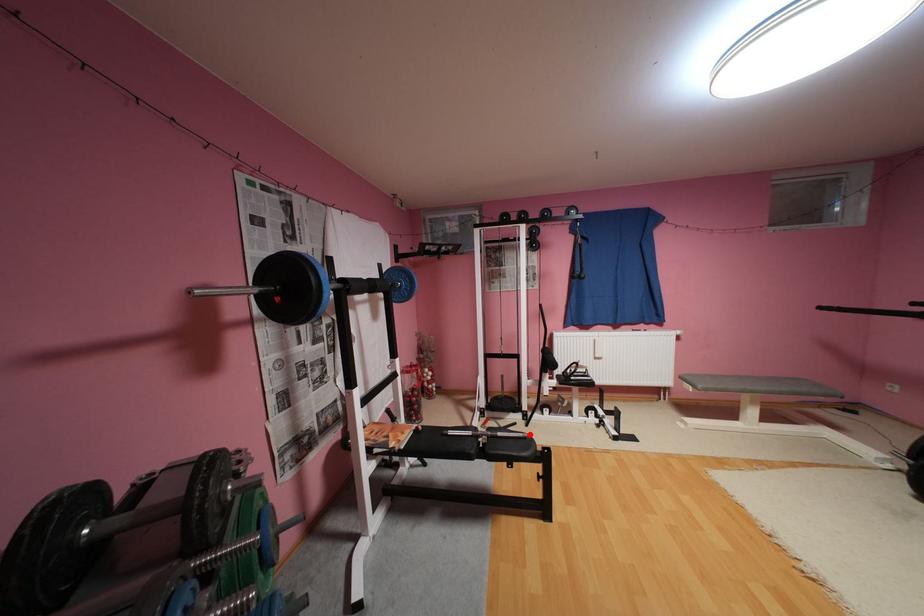
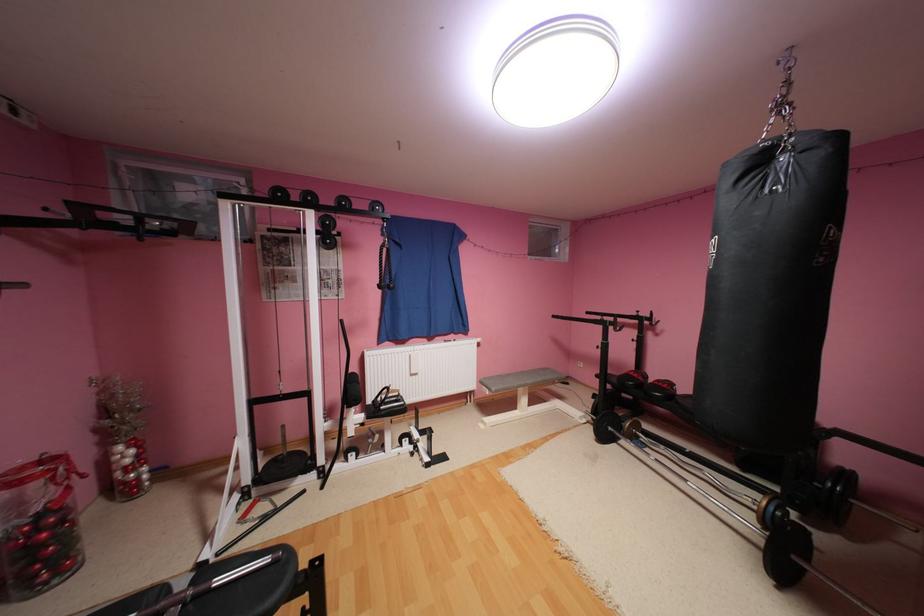
Where in the second image is the point corresponding to the highlighted location from the first image?

(276, 560)